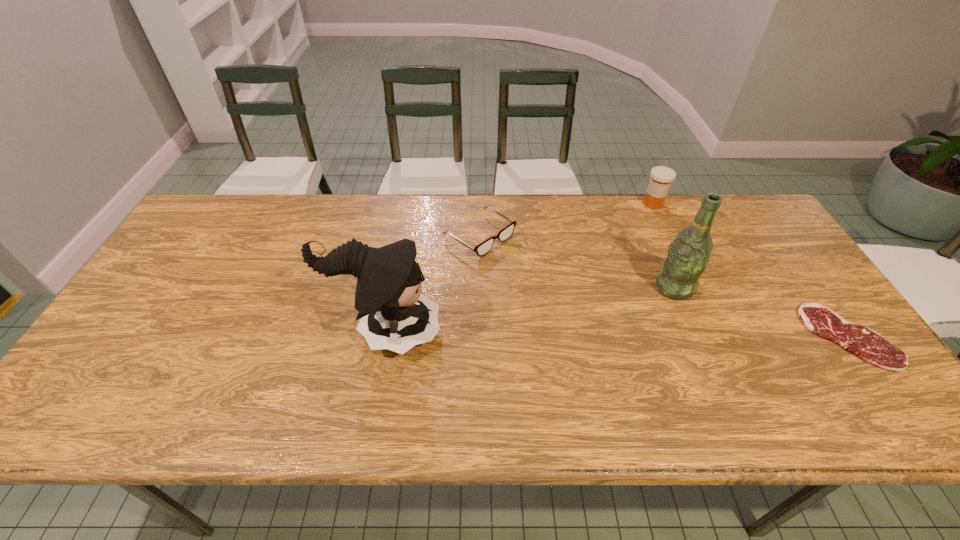
Where is `vacant region between the beer bottle and the doll`? Image resolution: width=960 pixels, height=540 pixels. vacant region between the beer bottle and the doll is located at coordinates (530, 309).

Find the location of a particular element. This screenshot has width=960, height=540. empty location between the doll and the fourth tallest object is located at coordinates (433, 284).

Locate an element on the screen. The width and height of the screenshot is (960, 540). vacant space that is in between the doll and the shortest object is located at coordinates (617, 334).

Where is `free space between the spectacles and the third tallest object`? free space between the spectacles and the third tallest object is located at coordinates (566, 220).

The width and height of the screenshot is (960, 540). Find the location of `vacant point located between the beer bottle and the doll`. vacant point located between the beer bottle and the doll is located at coordinates (530, 309).

The height and width of the screenshot is (540, 960). What are the coordinates of `free space between the steak and the doll` in the screenshot? It's located at (617, 334).

Where is `free spot between the doll and the farthest object`? This screenshot has height=540, width=960. free spot between the doll and the farthest object is located at coordinates (519, 267).

This screenshot has height=540, width=960. In order to click on vacant area between the doll and the second farthest object in this screenshot , I will do `click(433, 284)`.

The height and width of the screenshot is (540, 960). I want to click on vacant area that lies between the beer bottle and the doll, so click(x=530, y=309).

Identify which object is the fourth closest to the spectacles. Please provide its 2D coordinates. Your answer should be formatted as a tuple, i.e. [(x, y)], where the tuple contains the x and y coordinates of a point satisfying the conditions above.

[(867, 344)]